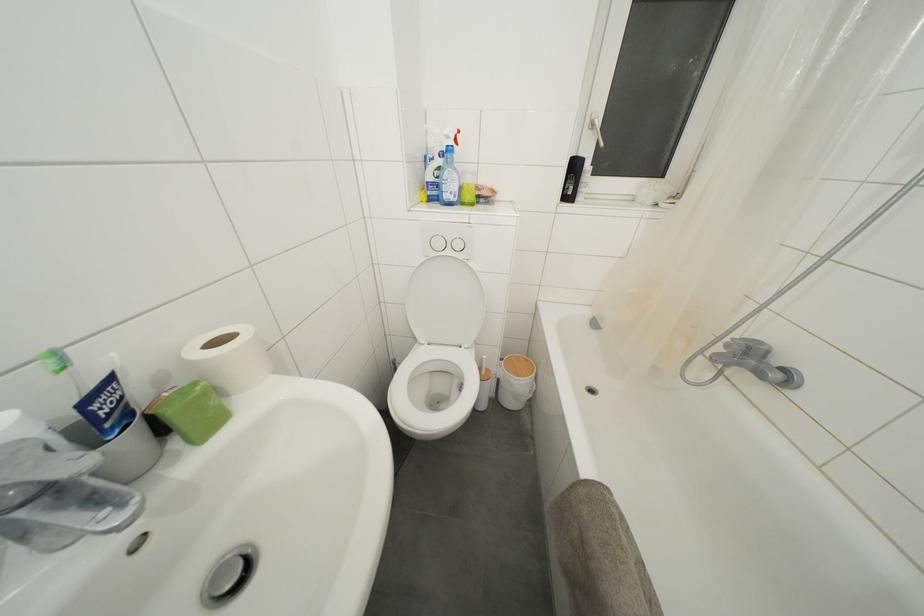
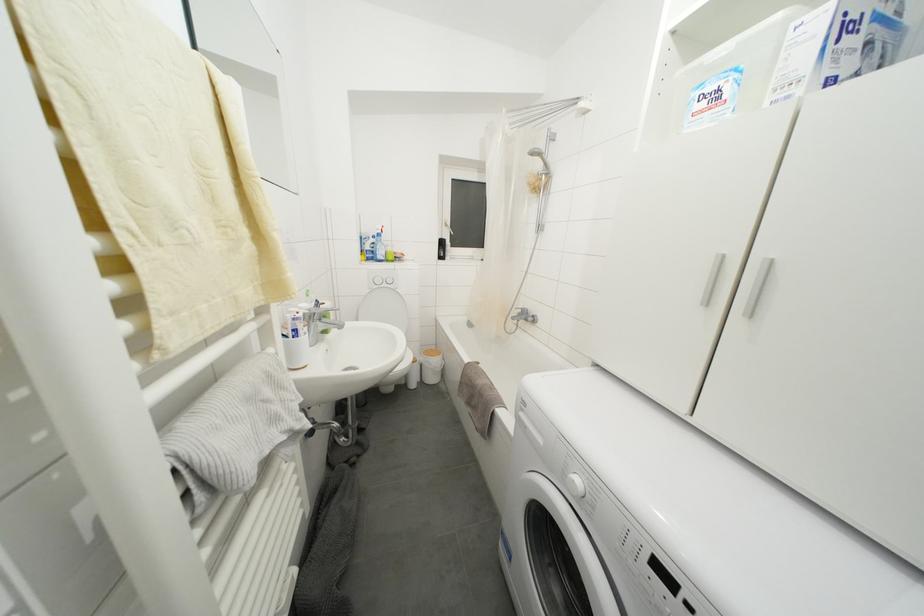
Question: The camera is either moving clockwise (left) or counter-clockwise (right) around the object. The first image is from the beginning of the video and the second image is from the end. Is the camera moving left or right when shooting the video?

Choices:
 (A) Left
 (B) Right

Answer: (A)